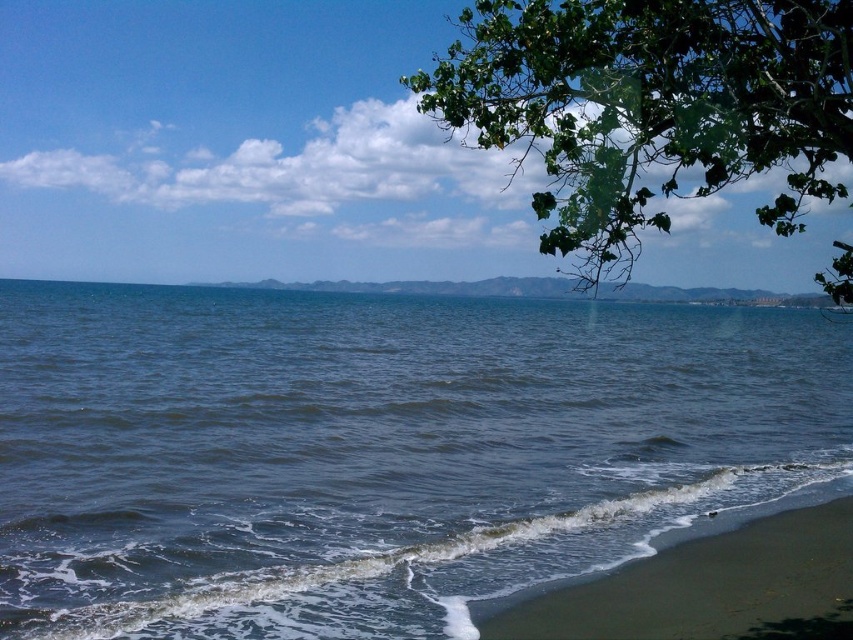
Question: Does dark blue water at lower center have a larger size compared to dark brown sand at lower right?

Choices:
 (A) yes
 (B) no

Answer: (A)

Question: Is dark blue water at lower center further to the viewer compared to green leafy tree at upper right?

Choices:
 (A) yes
 (B) no

Answer: (A)

Question: Which point is farther to the camera?

Choices:
 (A) green leafy tree at upper right
 (B) dark brown sand at lower right

Answer: (B)

Question: Which point is closer to the camera?

Choices:
 (A) (848, 600)
 (B) (560, 337)
 (C) (582, 276)

Answer: (C)

Question: Does green leafy tree at upper right lie in front of dark brown sand at lower right?

Choices:
 (A) yes
 (B) no

Answer: (A)

Question: Among these objects, which one is farthest from the camera?

Choices:
 (A) dark brown sand at lower right
 (B) dark blue water at lower center

Answer: (A)